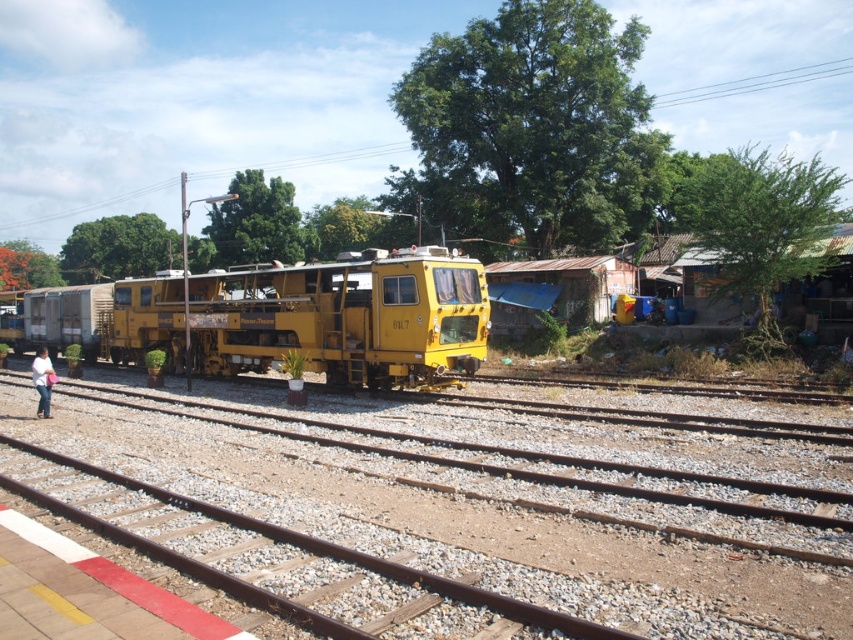
Question: Which of the following is the closest to the observer?

Choices:
 (A) brown gravel train track at center
 (B) light blue jeans at lower left

Answer: (A)

Question: Can you confirm if yellow matte train at center is wider than light blue jeans at lower left?

Choices:
 (A) no
 (B) yes

Answer: (B)

Question: Considering the real-world distances, which object is farthest from the yellow matte train at center?

Choices:
 (A) light blue jeans at lower left
 (B) brown gravel train track at center

Answer: (B)

Question: Estimate the real-world distances between objects in this image. Which object is closer to the yellow matte train at center?

Choices:
 (A) light blue jeans at lower left
 (B) brown gravel train track at center

Answer: (A)

Question: Does brown gravel train track at center have a smaller size compared to yellow matte train at center?

Choices:
 (A) yes
 (B) no

Answer: (A)

Question: Does yellow matte train at center appear under light blue jeans at lower left?

Choices:
 (A) no
 (B) yes

Answer: (A)